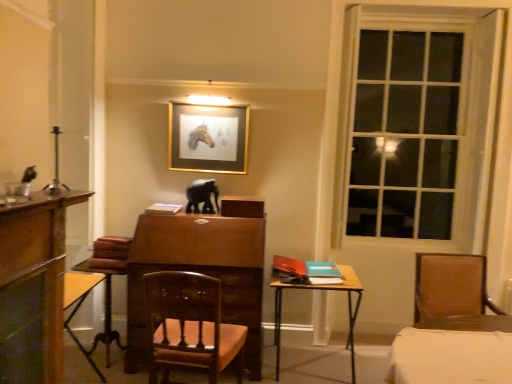
Question: In which direction should I rotate to look at wooden table at center, which ranks as the 2th table in left-to-right order?

Choices:
 (A) left
 (B) right

Answer: (B)

Question: Considering the relative sizes of clear glass window at right and black glossy elephant at center in the image provided, is clear glass window at right thinner than black glossy elephant at center?

Choices:
 (A) no
 (B) yes

Answer: (B)

Question: Is black glossy elephant at center a part of clear glass window at right?

Choices:
 (A) yes
 (B) no

Answer: (B)

Question: Does clear glass window at right appear on the left side of black glossy elephant at center?

Choices:
 (A) no
 (B) yes

Answer: (A)

Question: Can you confirm if clear glass window at right is smaller than black glossy elephant at center?

Choices:
 (A) yes
 (B) no

Answer: (B)

Question: Is clear glass window at right oriented away from black glossy elephant at center?

Choices:
 (A) yes
 (B) no

Answer: (B)

Question: Is clear glass window at right positioned in front of black glossy elephant at center?

Choices:
 (A) no
 (B) yes

Answer: (B)

Question: Is brown leather chair at right, marked as the 1th chair in a right-to-left arrangement, wider than gold metallic picture frame at upper center?

Choices:
 (A) yes
 (B) no

Answer: (A)

Question: Can you confirm if brown leather chair at right, placed as the second chair when sorted from left to right, is thinner than gold metallic picture frame at upper center?

Choices:
 (A) yes
 (B) no

Answer: (B)

Question: Considering the relative positions of brown leather chair at right, placed as the second chair when sorted from left to right, and gold metallic picture frame at upper center in the image provided, is brown leather chair at right, placed as the second chair when sorted from left to right, to the right of gold metallic picture frame at upper center from the viewer's perspective?

Choices:
 (A) no
 (B) yes

Answer: (B)

Question: Is brown leather chair at right, marked as the 1th chair in a right-to-left arrangement, not near gold metallic picture frame at upper center?

Choices:
 (A) no
 (B) yes

Answer: (B)

Question: Does brown leather chair at right, placed as the second chair when sorted from left to right, have a greater height compared to gold metallic picture frame at upper center?

Choices:
 (A) yes
 (B) no

Answer: (B)

Question: Could you tell me if brown leather chair at right, marked as the 1th chair in a right-to-left arrangement, is turned towards gold metallic picture frame at upper center?

Choices:
 (A) no
 (B) yes

Answer: (A)

Question: From the image's perspective, is wooden table at lower left, the 1th table in the left-to-right sequence, below black glossy elephant at center?

Choices:
 (A) no
 (B) yes

Answer: (B)